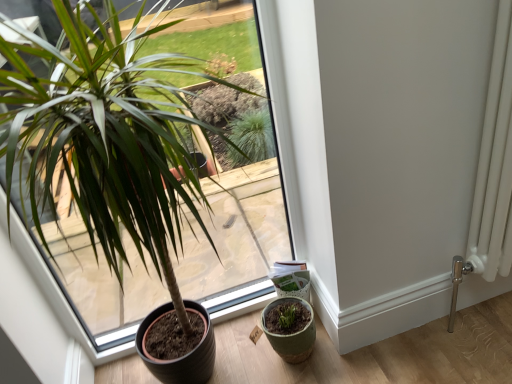
Question: Could you tell me if green matte flowerpot at lower right is facing green matte plant pot at lower left?

Choices:
 (A) yes
 (B) no

Answer: (B)

Question: Does green matte flowerpot at lower right have a greater width compared to green matte plant pot at lower left?

Choices:
 (A) yes
 (B) no

Answer: (B)

Question: From a real-world perspective, is green matte flowerpot at lower right located higher than green matte plant pot at lower left?

Choices:
 (A) yes
 (B) no

Answer: (B)

Question: Considering the relative sizes of green matte flowerpot at lower right and green matte plant pot at lower left in the image provided, is green matte flowerpot at lower right shorter than green matte plant pot at lower left?

Choices:
 (A) no
 (B) yes

Answer: (B)

Question: Is the depth of green matte flowerpot at lower right greater than that of green matte plant pot at lower left?

Choices:
 (A) yes
 (B) no

Answer: (A)

Question: Is green matte flowerpot at lower right in contact with green matte plant pot at lower left?

Choices:
 (A) no
 (B) yes

Answer: (A)

Question: Is green matte plant pot at lower left at the right side of green matte flowerpot at lower right?

Choices:
 (A) no
 (B) yes

Answer: (A)

Question: Can you confirm if green matte plant pot at lower left is positioned to the left of green matte flowerpot at lower right?

Choices:
 (A) yes
 (B) no

Answer: (A)

Question: From a real-world perspective, does green matte plant pot at lower left sit lower than green matte flowerpot at lower right?

Choices:
 (A) yes
 (B) no

Answer: (B)

Question: From the image's perspective, is green matte plant pot at lower left beneath green matte flowerpot at lower right?

Choices:
 (A) yes
 (B) no

Answer: (B)

Question: From the image's perspective, is green matte plant pot at lower left on top of green matte flowerpot at lower right?

Choices:
 (A) no
 (B) yes

Answer: (B)

Question: Can you confirm if green matte plant pot at lower left is taller than green matte flowerpot at lower right?

Choices:
 (A) yes
 (B) no

Answer: (A)

Question: Considering their positions, is green matte plant pot at lower left located in front of or behind green matte flowerpot at lower right?

Choices:
 (A) behind
 (B) front

Answer: (B)